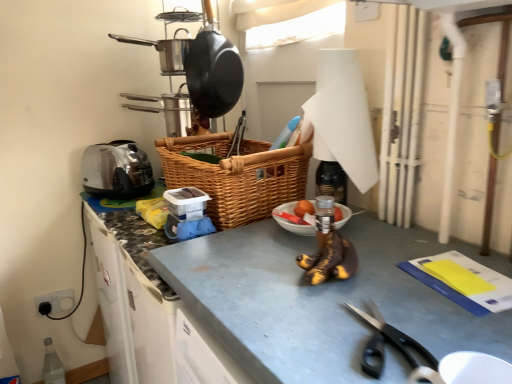
I want to click on free space behind black plastic scissors at lower right, so click(354, 282).